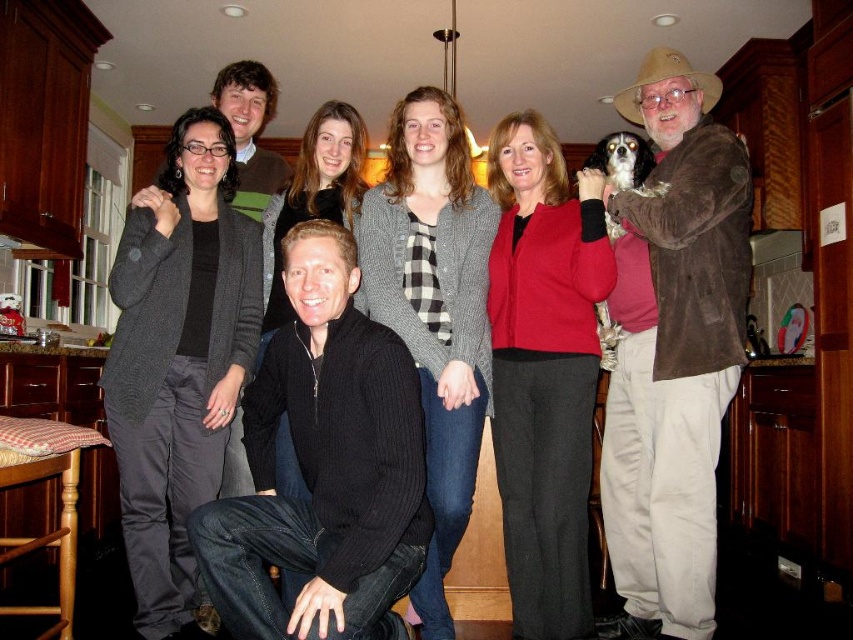
Where is `dark gray cardigan at center`? This screenshot has width=853, height=640. dark gray cardigan at center is located at coordinates (178, 360).

Consider the image. Between dark gray cardigan at center and red wool sweater at center, which one has less height?

red wool sweater at center

This screenshot has width=853, height=640. Describe the element at coordinates (178, 360) in the screenshot. I see `dark gray cardigan at center` at that location.

Image resolution: width=853 pixels, height=640 pixels. I want to click on dark gray cardigan at center, so click(x=178, y=360).

Between brown suede jacket at upper right and matte gray cardigan at center, which one is positioned lower?

brown suede jacket at upper right is below.

Between brown suede jacket at upper right and matte gray cardigan at center, which one appears on the left side from the viewer's perspective?

From the viewer's perspective, matte gray cardigan at center appears more on the left side.

The width and height of the screenshot is (853, 640). What do you see at coordinates (672, 352) in the screenshot?
I see `brown suede jacket at upper right` at bounding box center [672, 352].

Locate an element on the screen. The height and width of the screenshot is (640, 853). brown suede jacket at upper right is located at coordinates (672, 352).

Is matte black sweater at center bigger than brown suede jacket at upper right?

Yes.

From the picture: Is matte black sweater at center in front of brown suede jacket at upper right?

Yes.

Is point (666, 524) farther from viewer compared to point (715, 506)?

That is False.

You are a GUI agent. You are given a task and a screenshot of the screen. Output one action in this format:
    pyautogui.click(x=<x>, y=<y>)
    Task: Click on the matte black sweater at center
    
    Given the screenshot: What is the action you would take?
    click(x=671, y=349)